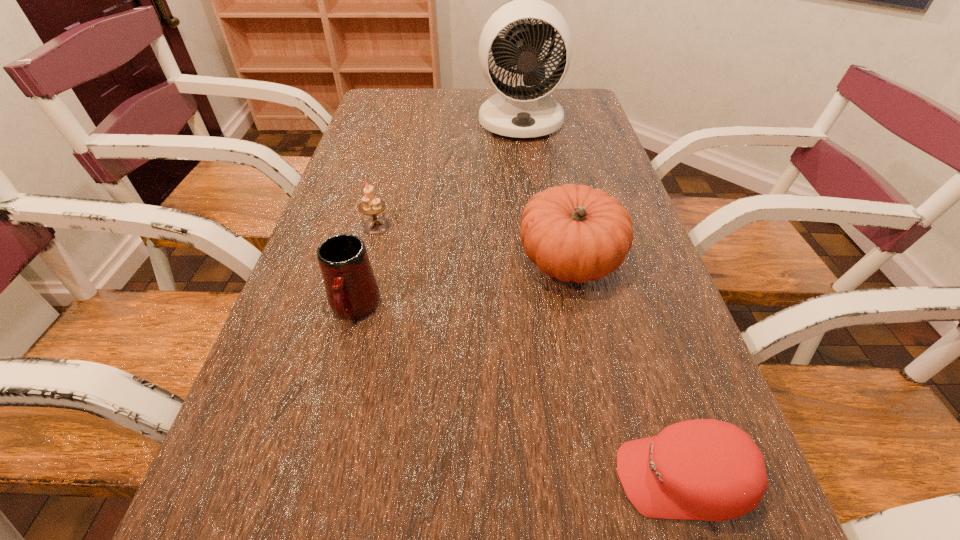
Locate an element on the screen. object that is positioned at the far right corner is located at coordinates (520, 111).

You are a GUI agent. You are given a task and a screenshot of the screen. Output one action in this format:
    pyautogui.click(x=<x>, y=<y>)
    Task: Click on the vacant space at the far edge of the desktop
    The image size is (960, 540).
    Given the screenshot: What is the action you would take?
    pyautogui.click(x=435, y=88)

Identify the location of free space at the left edge. The height and width of the screenshot is (540, 960). click(x=313, y=315).

Locate an element on the screen. This screenshot has width=960, height=540. vacant point at the right edge is located at coordinates (559, 137).

I want to click on free point at the far right corner, so click(x=581, y=110).

Locate an element on the screen. The image size is (960, 540). free spot between the tallest object and the mug is located at coordinates (438, 215).

Locate an element on the screen. This screenshot has width=960, height=540. vacant region between the pumpkin and the mug is located at coordinates (462, 285).

At what (x,y) coordinates should I click in order to perform the action: click on vacant point located between the shortest object and the pumpkin. Please return your answer as a coordinate pair (x, y). Image resolution: width=960 pixels, height=540 pixels. Looking at the image, I should click on (626, 369).

At what (x,y) coordinates should I click in order to perform the action: click on unoccupied position between the pumpkin and the candle holder. Please return your answer as a coordinate pair (x, y). This screenshot has height=540, width=960. Looking at the image, I should click on (473, 244).

The height and width of the screenshot is (540, 960). Identify the location of vacant point located between the fan and the fourth tallest object. (448, 174).